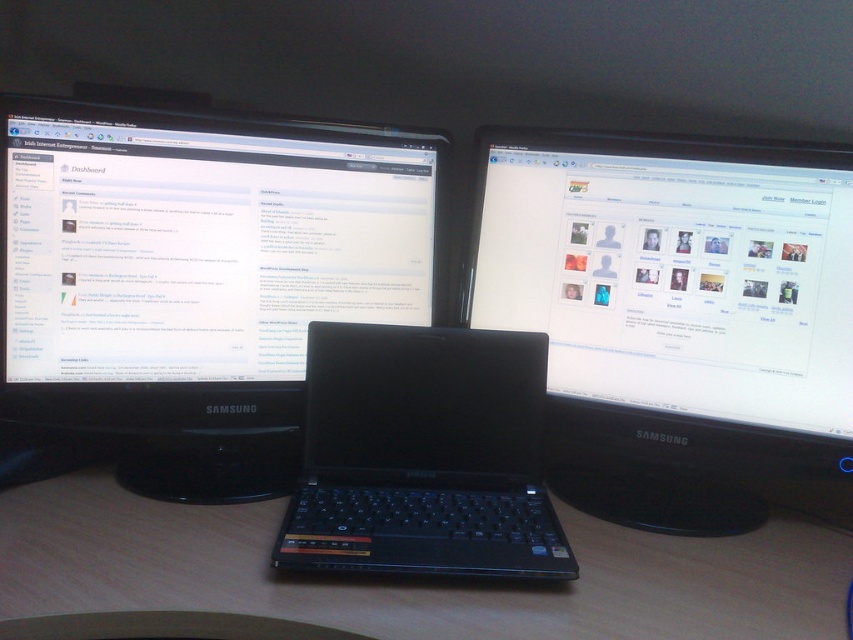
You are setting up a new monitor stand that requires knowing the height difference between the black glossy monitor at upper left and the wooden at center. Based on the scene description, which monitor is taller?

The black glossy monitor at upper left is taller than the wooden at center.